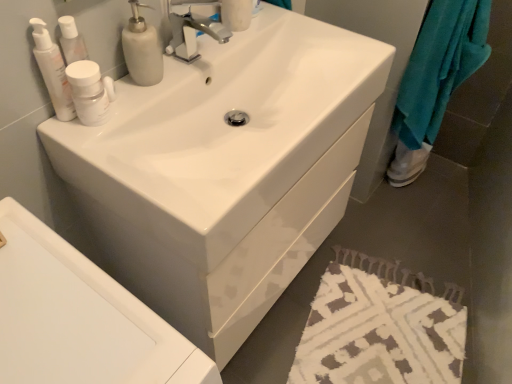
Image resolution: width=512 pixels, height=384 pixels. Identify the location of vacant space behind white textured bath mat at lower right. (402, 224).